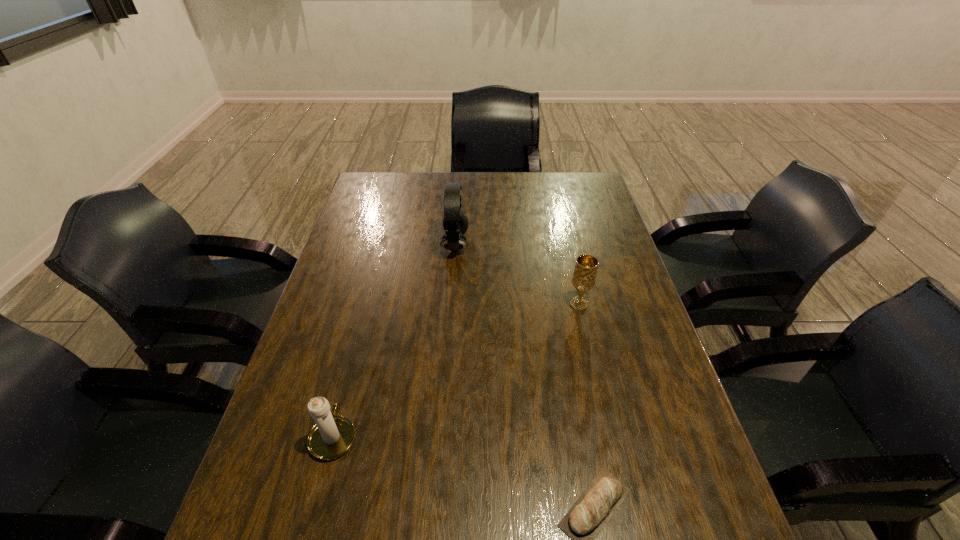
Locate an element on the screen. This screenshot has width=960, height=540. object located in the left edge section of the desktop is located at coordinates (332, 436).

Where is `object located at the right edge`? object located at the right edge is located at coordinates (584, 276).

In the image, there is a desktop. Identify the location of vacant space at the far edge. The image size is (960, 540). (426, 199).

The width and height of the screenshot is (960, 540). Identify the location of free location at the left edge of the desktop. (323, 292).

Image resolution: width=960 pixels, height=540 pixels. Identify the location of vacant area at the far left corner of the desktop. (378, 174).

Locate an element on the screen. This screenshot has width=960, height=540. blank region between the chalice and the third farthest object is located at coordinates (456, 370).

This screenshot has width=960, height=540. I want to click on vacant space in between the third object from right to left and the second nearest object, so click(x=395, y=340).

Locate an element on the screen. vacant region between the second nearest object and the third nearest object is located at coordinates (456, 370).

Find the location of a particular element. Image resolution: width=960 pixels, height=540 pixels. free area in between the chalice and the candle holder is located at coordinates (456, 370).

At what (x,y) coordinates should I click in order to perform the action: click on free space between the candle holder and the second object from left to right. Please return your answer as a coordinate pair (x, y). Image resolution: width=960 pixels, height=540 pixels. Looking at the image, I should click on (395, 340).